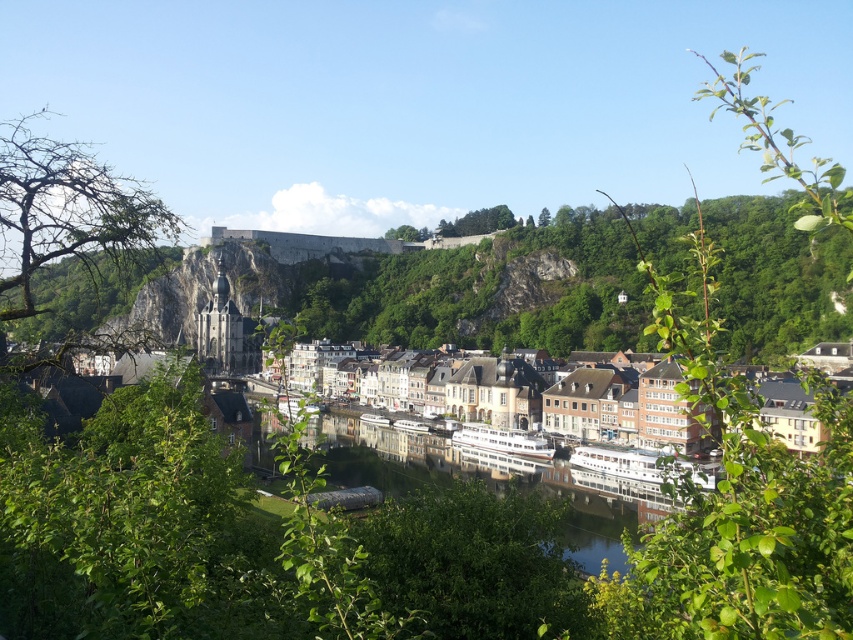
You are an artist sketching the riverside town. You notice the green leafy branch at upper right and the green leafy tree at left. Which one should you draw first to ensure proper perspective?

You should draw the green leafy tree at left first because it is larger and closer to the viewer compared to the green leafy branch at upper right, which is smaller and farther away.

You are an artist sketching the riverside town and want to include both the green leafy branch at upper right and the green leafy tree at left in your drawing. Which of the two should you draw with a thinner stroke to accurately represent their sizes?

The green leafy branch at upper right has a lesser width compared to the green leafy tree at left, so you should draw the green leafy branch at upper right with a thinner stroke to accurately represent their sizes.

You are a tourist standing at the riverside in the town. You see the green leafy branch at upper right and the white glossy waterway at center. Which object is positioned to the right of the other?

The green leafy branch at upper right is to the right of the white glossy waterway at center.